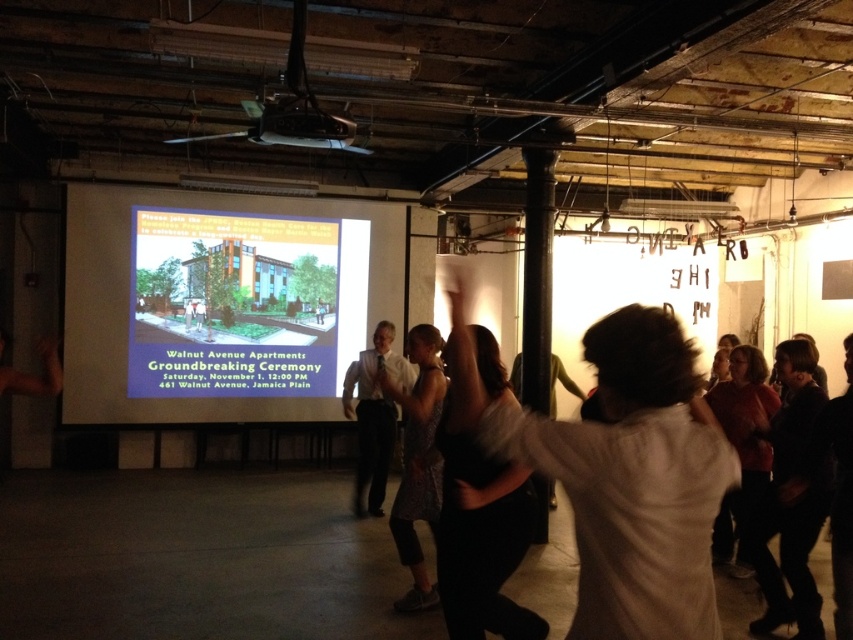
Between point (289, 282) and point (370, 460), which one is positioned behind?

The point (289, 282) is more distant.

Which is above, matte green building at center or white shirt at center?

matte green building at center is higher up.

Who is more distant from viewer, (310, 358) or (364, 464)?

Positioned behind is point (310, 358).

Find the location of `matte green building at center`. matte green building at center is located at coordinates (231, 305).

This screenshot has width=853, height=640. What do you see at coordinates (231, 305) in the screenshot?
I see `matte green building at center` at bounding box center [231, 305].

Who is more forward, (180, 218) or (262, 132)?

Point (262, 132)

Where is `matte green building at center`? This screenshot has width=853, height=640. matte green building at center is located at coordinates (231, 305).

Which is below, printed fabric dress at center or matte black projector at upper center?

printed fabric dress at center is lower down.

Is point (413, 444) positioned behind point (351, 131)?

No, (413, 444) is in front of (351, 131).

Identify the location of printed fabric dress at center. (416, 460).